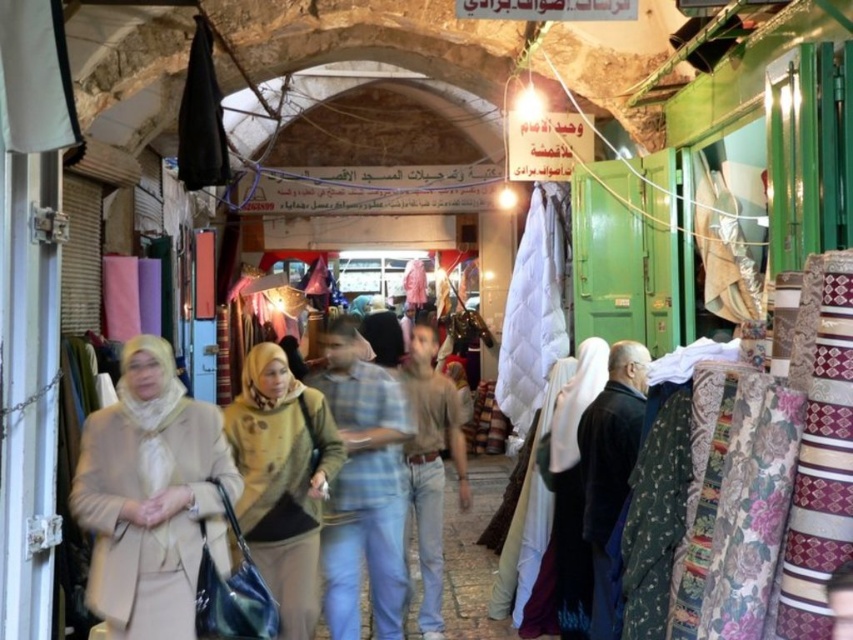
You are a customer in this market and want to purchase both the beige knitted sweater at center and the denim jeans at center. However, you notice that the seller has placed them in a specific arrangement. Can you determine which item is closer to you?

The beige knitted sweater at center is in front of the denim jeans at center, so the sweater is closer to you.

You are a customer in this market and want to buy both the beige knitted sweater at center and the denim jeans at center. However, you notice that the seller has placed them in a specific arrangement. Can you determine which item is placed on top of the other?

The beige knitted sweater at center is positioned over denim jeans at center, so the sweater is on top of the jeans.

You are standing in the market and want to buy a beige knitted sweater. You see a point at coordinates (283, 481). Is this point located on the beige knitted sweater at center?

Yes, the point at coordinates (283, 481) is located on the beige knitted sweater at center.